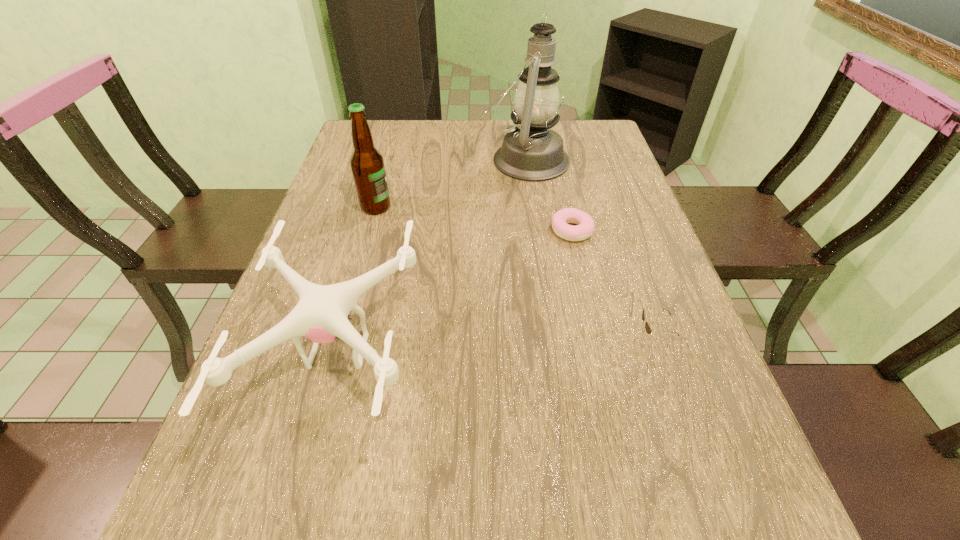
Where is `vacant space located on the label of the fourth nearest object`? The width and height of the screenshot is (960, 540). vacant space located on the label of the fourth nearest object is located at coordinates (504, 207).

Find the location of a particular element. free region located on the top of the third shortest object is located at coordinates (472, 350).

You are a GUI agent. You are given a task and a screenshot of the screen. Output one action in this format:
    pyautogui.click(x=<x>, y=<y>)
    Task: Click on the vacant space located in front of the lenses of the rightmost object
    
    Given the screenshot: What is the action you would take?
    pyautogui.click(x=545, y=338)

This screenshot has height=540, width=960. I want to click on vacant point located 0.310m in front of the lenses of the rightmost object, so click(480, 338).

Where is `vacant region located 0.340m in front of the lenses of the rightmost object`? The height and width of the screenshot is (540, 960). vacant region located 0.340m in front of the lenses of the rightmost object is located at coordinates (465, 338).

The image size is (960, 540). Find the location of `free space located 0.400m on the back of the shortest object`. free space located 0.400m on the back of the shortest object is located at coordinates (551, 142).

Where is `object situated at the far edge`? The image size is (960, 540). object situated at the far edge is located at coordinates (531, 151).

Locate an element on the screen. The image size is (960, 540). beer bottle located at the left edge is located at coordinates (367, 164).

Where is `drone located in the left edge section of the desktop`? The width and height of the screenshot is (960, 540). drone located in the left edge section of the desktop is located at coordinates (321, 315).

Identify the location of oil lamp located in the right edge section of the desktop. (531, 151).